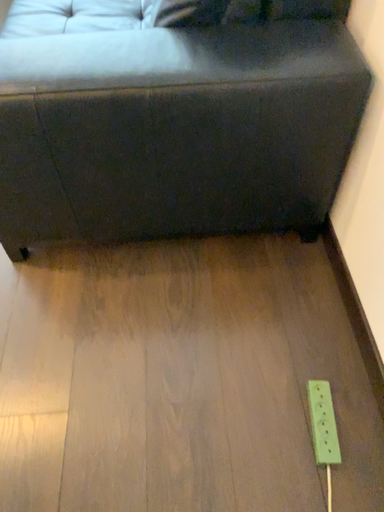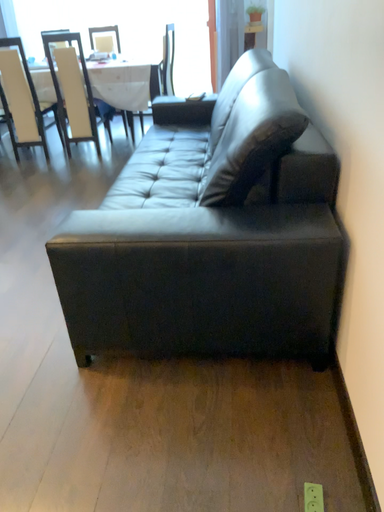
Question: Which way did the camera rotate in the video?

Choices:
 (A) rotated downward
 (B) rotated upward

Answer: (B)